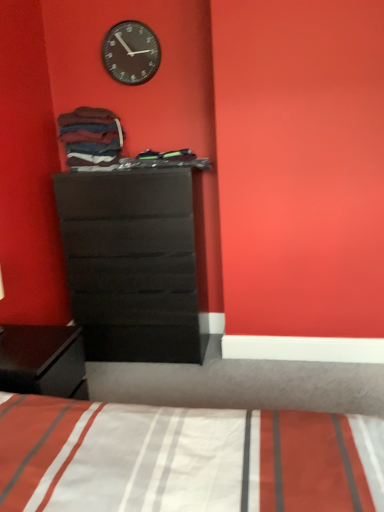
The height and width of the screenshot is (512, 384). In order to click on matte black dresser at center in this screenshot , I will do `click(131, 263)`.

I want to click on clothing below the black matte clock at upper center (from a real-world perspective), so click(x=91, y=135).

Is black matte clock at upper center beside dark brown cotton socks at upper left?

black matte clock at upper center and dark brown cotton socks at upper left are not in contact.

From the image's perspective, between black matte clock at upper center and dark brown cotton socks at upper left, which one is located above?

From the image's view, black matte clock at upper center is above.

How far apart are black matte clock at upper center and dark brown cotton socks at upper left?

black matte clock at upper center and dark brown cotton socks at upper left are 19.95 inches apart from each other.

Based on the photo, from a real-world perspective, is matte black dresser at center located beneath black matte clock at upper center?

Yes, from a real-world perspective, matte black dresser at center is beneath black matte clock at upper center.

Is matte black dresser at center positioned in front of black matte clock at upper center?

Yes, it is in front of black matte clock at upper center.

From a real-world perspective, which object rests below the other?

matte black dresser at center.

Considering the sizes of objects black matte clock at upper center and matte black dresser at center in the image provided, who is smaller, black matte clock at upper center or matte black dresser at center?

black matte clock at upper center is smaller.

Could you tell me if black matte clock at upper center is facing matte black dresser at center?

No, black matte clock at upper center is not aimed at matte black dresser at center.

Identify the location of chest of drawers lying on the right of black matte clock at upper center. Image resolution: width=384 pixels, height=512 pixels. (131, 263).

You are a GUI agent. You are given a task and a screenshot of the screen. Output one action in this format:
    pyautogui.click(x=<x>, y=<y>)
    Task: Click on the clothing beneath the black matte clock at upper center (from a real-world perspective)
    
    Given the screenshot: What is the action you would take?
    pyautogui.click(x=91, y=135)

Consider the image. Is dark brown cotton socks at upper left positioned behind black matte clock at upper center?

No, dark brown cotton socks at upper left is closer to the camera.

Is dark brown cotton socks at upper left positioned beyond the bounds of black matte clock at upper center?

That's correct, dark brown cotton socks at upper left is outside of black matte clock at upper center.

Between dark brown cotton socks at upper left and black matte clock at upper center, which one has smaller width?

black matte clock at upper center is thinner.

Based on the photo, does matte black dresser at center come behind dark brown cotton socks at upper left?

No, matte black dresser at center is closer to the camera.

Considering the points (160, 322) and (91, 112), which point is behind, point (160, 322) or point (91, 112)?

The point (160, 322) is behind.

Is matte black dresser at center wider or thinner than dark brown cotton socks at upper left?

matte black dresser at center is wider than dark brown cotton socks at upper left.

Is point (107, 141) less distant than point (172, 243)?

Yes, it is.

Which is more to the left, dark brown cotton socks at upper left or matte black dresser at center?

dark brown cotton socks at upper left is more to the left.

Based on the photo, considering the sizes of dark brown cotton socks at upper left and matte black dresser at center in the image, is dark brown cotton socks at upper left wider or thinner than matte black dresser at center?

Clearly, dark brown cotton socks at upper left has less width compared to matte black dresser at center.

What's the angular difference between dark brown cotton socks at upper left and matte black dresser at center's facing directions?

There is a 0.00101-degree angle between the facing directions of dark brown cotton socks at upper left and matte black dresser at center.

Locate an element on the screen. clothing located on the left of black matte clock at upper center is located at coordinates (91, 135).

At what (x,y) coordinates should I click in order to perform the action: click on the chest of drawers below the black matte clock at upper center (from a real-world perspective). Please return your answer as a coordinate pair (x, y). The width and height of the screenshot is (384, 512). Looking at the image, I should click on coord(131,263).

From the image, which object appears to be farther from black matte clock at upper center, dark brown cotton socks at upper left or matte black dresser at center?

Based on the image, matte black dresser at center appears to be further to black matte clock at upper center.

Looking at the image, which one is located further to matte black dresser at center, dark brown cotton socks at upper left or black matte clock at upper center?

black matte clock at upper center.

Considering their positions, is matte black dresser at center positioned closer to dark brown cotton socks at upper left than black matte clock at upper center?

Among the two, black matte clock at upper center is located nearer to dark brown cotton socks at upper left.

Looking at this image, considering their positions, is black matte clock at upper center positioned closer to matte black dresser at center than dark brown cotton socks at upper left?

dark brown cotton socks at upper left is positioned closer to the anchor matte black dresser at center.

Based on their spatial positions, is black matte clock at upper center or matte black dresser at center closer to dark brown cotton socks at upper left?

black matte clock at upper center is closer to dark brown cotton socks at upper left.

Which object lies nearer to the anchor point black matte clock at upper center, matte black dresser at center or dark brown cotton socks at upper left?

dark brown cotton socks at upper left is positioned closer to the anchor black matte clock at upper center.

This screenshot has height=512, width=384. In order to click on clothing between black matte clock at upper center and matte black dresser at center vertically in this screenshot , I will do `click(91, 135)`.